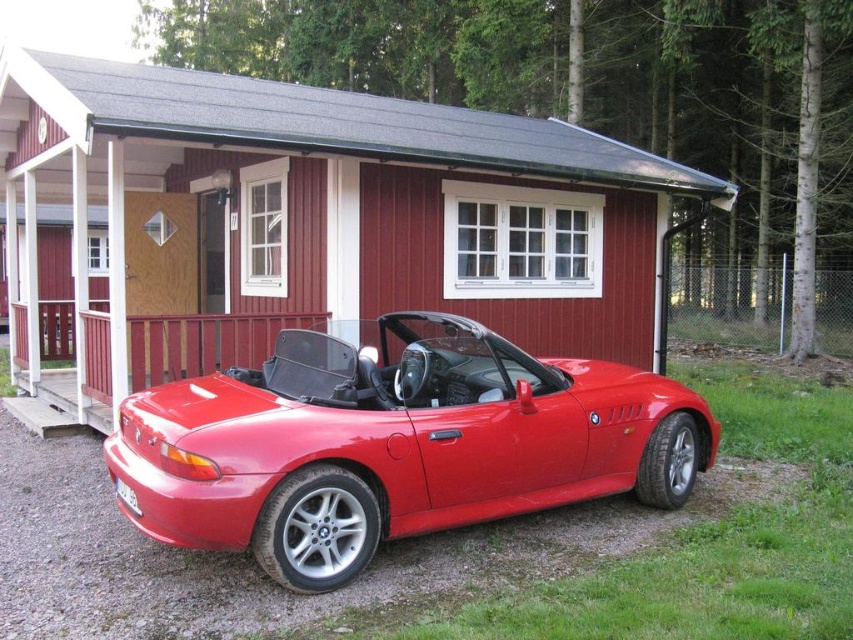
Question: Estimate the real-world distances between objects in this image. Which object is farther from the shiny red convertible at center?

Choices:
 (A) red wood cabin at center
 (B) wooden railing at lower left

Answer: (A)

Question: Among these objects, which one is farthest from the camera?

Choices:
 (A) shiny red convertible at center
 (B) red wood cabin at center

Answer: (B)

Question: Where is shiny red convertible at center located in relation to wooden railing at lower left in the image?

Choices:
 (A) right
 (B) left

Answer: (A)

Question: Is red wood cabin at center thinner than wooden railing at lower left?

Choices:
 (A) yes
 (B) no

Answer: (B)

Question: Is shiny red convertible at center closer to the viewer compared to wooden railing at lower left?

Choices:
 (A) no
 (B) yes

Answer: (B)

Question: Estimate the real-world distances between objects in this image. Which object is farther from the shiny red convertible at center?

Choices:
 (A) wooden railing at lower left
 (B) red wood cabin at center

Answer: (B)